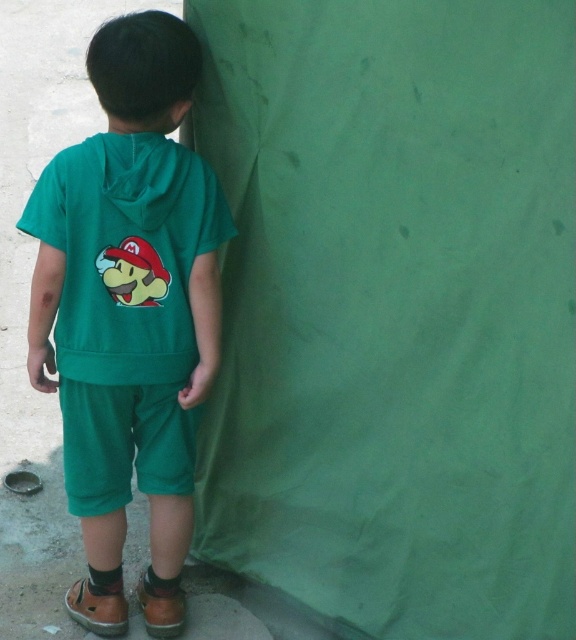
Which is behind, point (177, 540) or point (176, 436)?

The point (177, 540) is behind.

Does matte green hoodie at center appear on the left side of green cotton shorts at lower center?

Indeed, matte green hoodie at center is positioned on the left side of green cotton shorts at lower center.

Is point (25, 220) positioned before point (147, 461)?

That is True.

This screenshot has height=640, width=576. Identify the location of matte green hoodie at center. pyautogui.click(x=130, y=312).